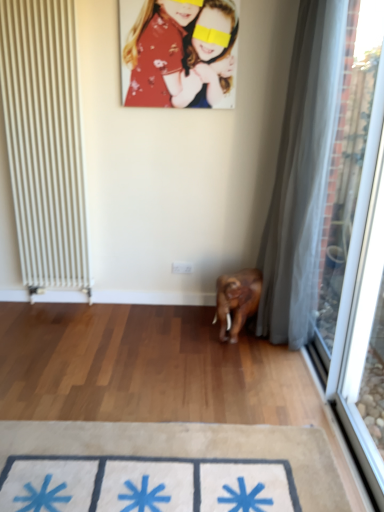
Question: From the image's perspective, is floral fabric portrait at upper center on top of transparent fabric at right?

Choices:
 (A) yes
 (B) no

Answer: (A)

Question: Can you confirm if floral fabric portrait at upper center is shorter than transparent fabric at right?

Choices:
 (A) no
 (B) yes

Answer: (B)

Question: From a real-world perspective, is floral fabric portrait at upper center positioned over transparent fabric at right based on gravity?

Choices:
 (A) no
 (B) yes

Answer: (B)

Question: Is the depth of floral fabric portrait at upper center greater than that of transparent fabric at right?

Choices:
 (A) no
 (B) yes

Answer: (B)

Question: Is floral fabric portrait at upper center to the right of transparent fabric at right from the viewer's perspective?

Choices:
 (A) yes
 (B) no

Answer: (B)

Question: In terms of width, does white sheer curtain at right look wider or thinner when compared to floral fabric portrait at upper center?

Choices:
 (A) thin
 (B) wide

Answer: (B)

Question: Is white sheer curtain at right in front of or behind floral fabric portrait at upper center in the image?

Choices:
 (A) front
 (B) behind

Answer: (A)

Question: Is point (311, 135) closer or farther from the camera than point (140, 69)?

Choices:
 (A) farther
 (B) closer

Answer: (B)

Question: Is white sheer curtain at right inside or outside of floral fabric portrait at upper center?

Choices:
 (A) inside
 (B) outside

Answer: (B)

Question: Visually, is white metal radiator at left positioned to the left or to the right of beige fabric doormat at lower center?

Choices:
 (A) right
 (B) left

Answer: (B)

Question: Considering the positions of white metal radiator at left and beige fabric doormat at lower center in the image, is white metal radiator at left bigger or smaller than beige fabric doormat at lower center?

Choices:
 (A) small
 (B) big

Answer: (B)

Question: Considering their positions, is white metal radiator at left located in front of or behind beige fabric doormat at lower center?

Choices:
 (A) behind
 (B) front

Answer: (A)

Question: Which is correct: white metal radiator at left is inside beige fabric doormat at lower center, or outside of it?

Choices:
 (A) outside
 (B) inside

Answer: (A)

Question: Considering the positions of point (327, 22) and point (19, 3), is point (327, 22) closer or farther from the camera than point (19, 3)?

Choices:
 (A) closer
 (B) farther

Answer: (A)

Question: In the image, is white sheer curtain at right positioned in front of or behind white metal radiator at left?

Choices:
 (A) behind
 (B) front

Answer: (B)